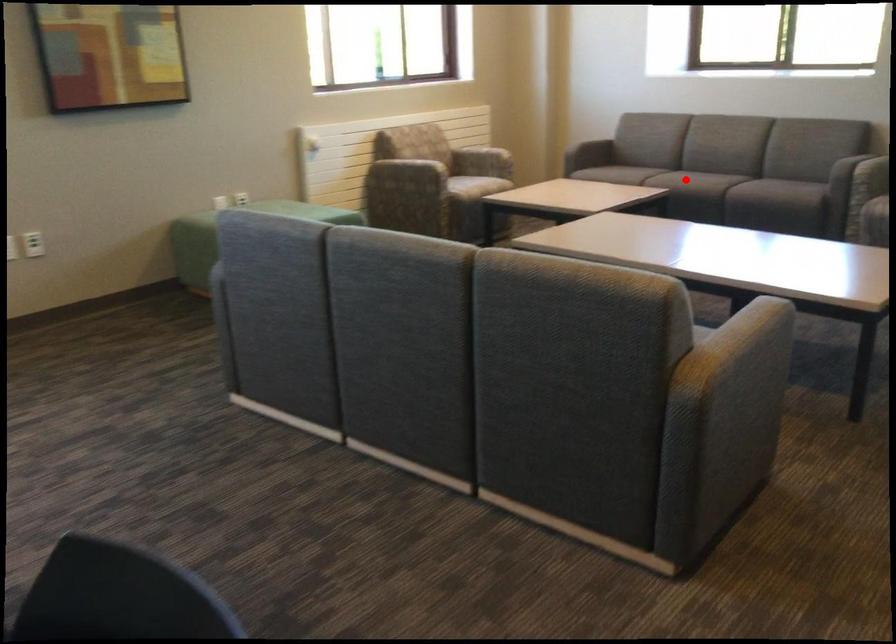
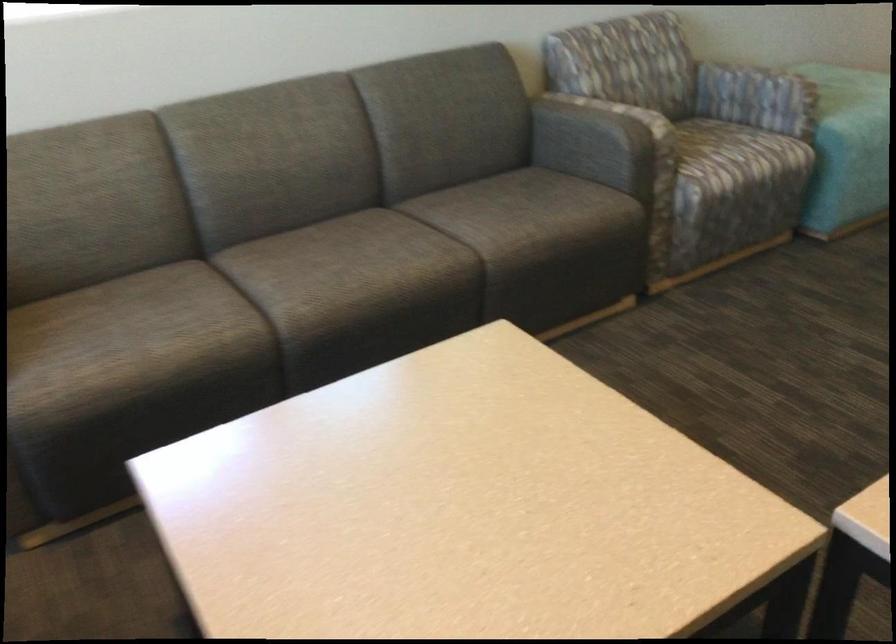
Locate, in the second image, the point that corresponds to the highlighted location in the first image.

(427, 269)